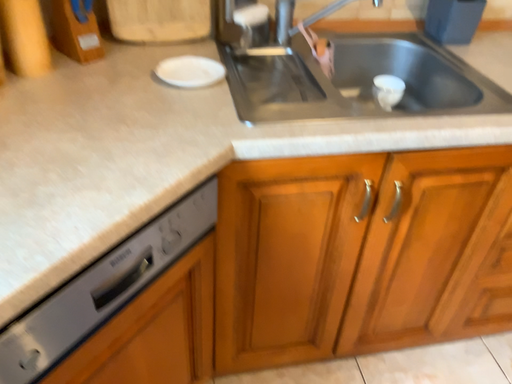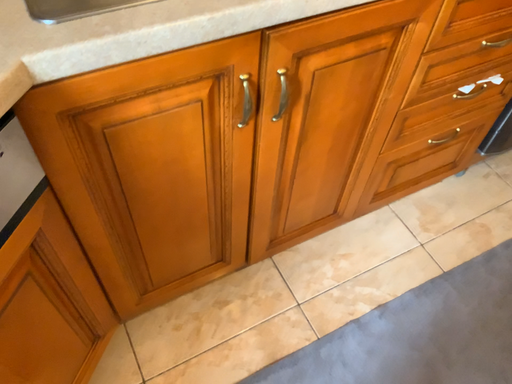
Question: How did the camera likely rotate when shooting the video?

Choices:
 (A) rotated upward
 (B) rotated downward

Answer: (B)